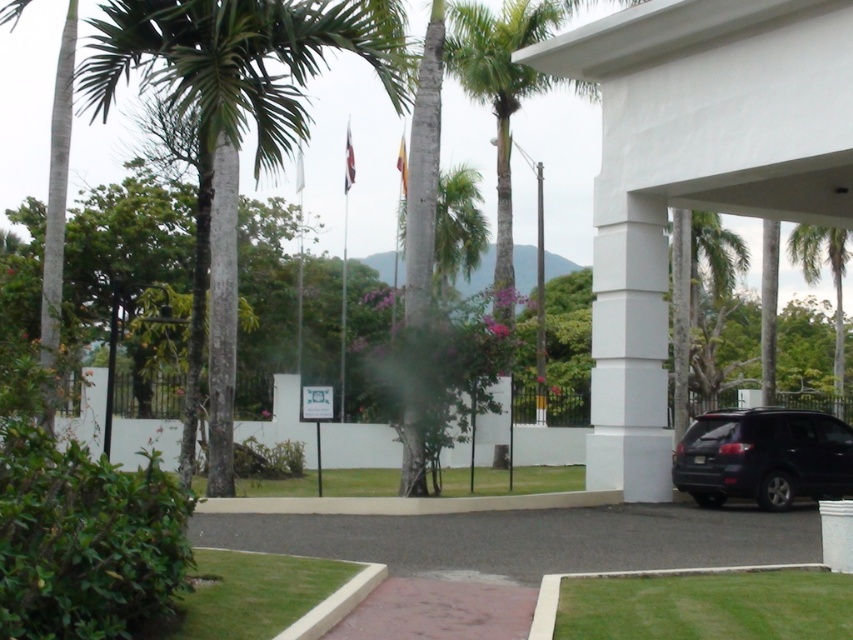
You are standing at the entrance on the right side of the image. Looking towards the center, can you see the green textured palm tree at center? Please explain your reasoning based on the scene description.

Yes, the green textured palm tree at center is located at point (236, 115), which is within the central area of the image. Since the scene has a clear line of sight from the entrance towards the center with no obstructions mentioned, you can see the green textured palm tree at center from the entrance.

You are standing at the entrance of the white structure on the right side of the lawn. You see two points marked in the scene, point 1 at coordinates point (726, 262) and point 2 at coordinates point (804, 243). Which point is closer to you?

Point (726, 262) is in front of point (804, 243), so it is closer to you.

You are standing at the entrance on the right side of the image. Looking towards the green leafy palm tree at upper right, is it positioned to your left or right?

The green leafy palm tree at upper right is located at point 0.434 on the x axis and 0.975 on the y axis. Since you are facing the entrance, the palm tree would be to your left.